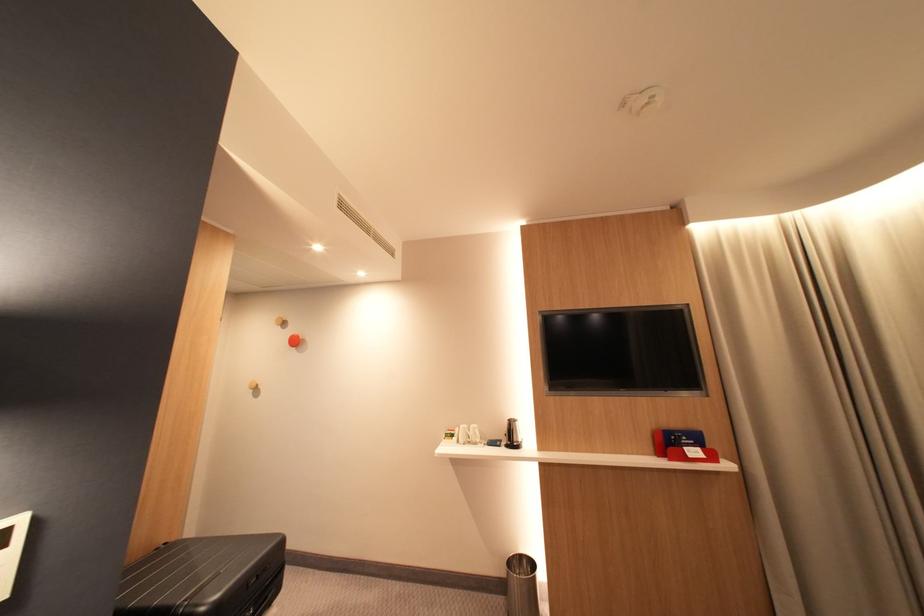
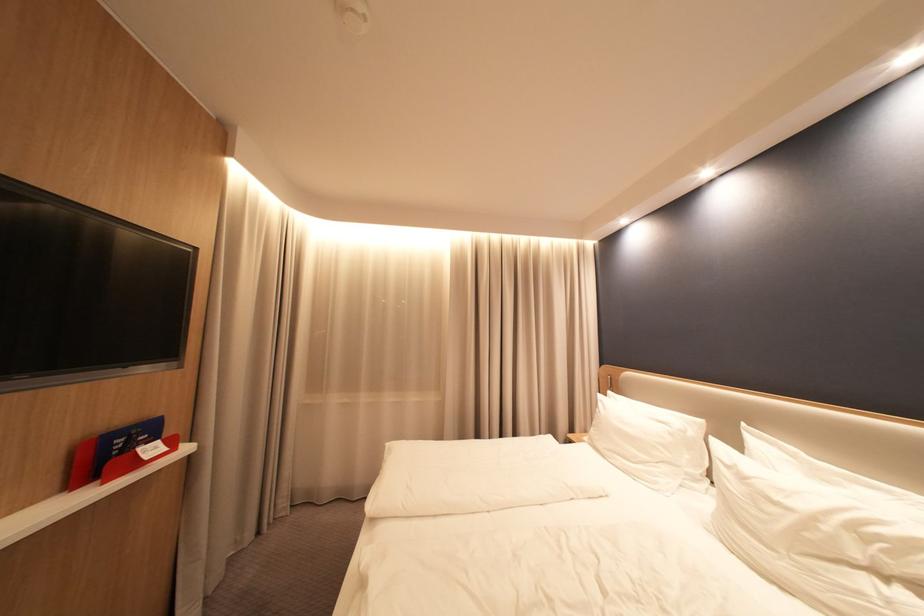
The point at (737, 467) is marked in the first image. Where is the corresponding point in the second image?

(197, 450)